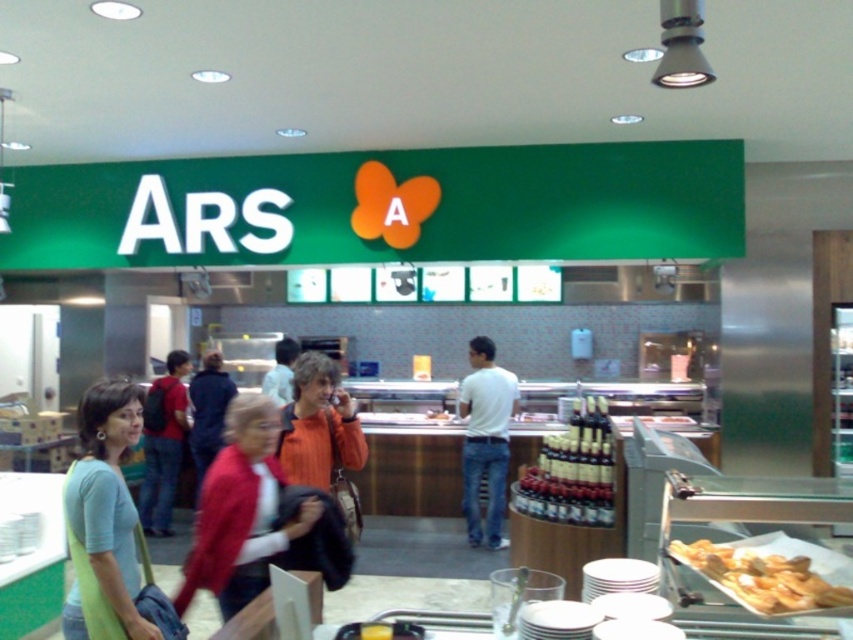
Based on the photo, you are a customer at the ARS counter. You want to place the golden crispy pastry at lower right on the counter next to the translucent glass bottle at center. Is there enough space between them?

The golden crispy pastry at lower right might be wider than the translucent glass bottle at center, so there may not be enough space between them. Please check the actual dimensions before placing.

You are a customer standing at the ARS counter. You want to grab a bottle from the shiny glass bottles at center and then pick up the white matte shirt at center. Which item will you reach first?

The shiny glass bottles at center is closer to the viewer than the white matte shirt at center, so you will reach the shiny glass bottles at center first.

You are a delivery person standing at the entrance of the food service area. You need to pick up a package from the counter labeled ARS. The package is either the red sweater at center or the white matte shirt at center. Which one is closer to you?

The red sweater at center is 3.49 meters away from the white matte shirt at center. Since both are at the center, the distance from you to each would depend on your position. However, without specific information about your exact location, it is impossible to determine which is closer.